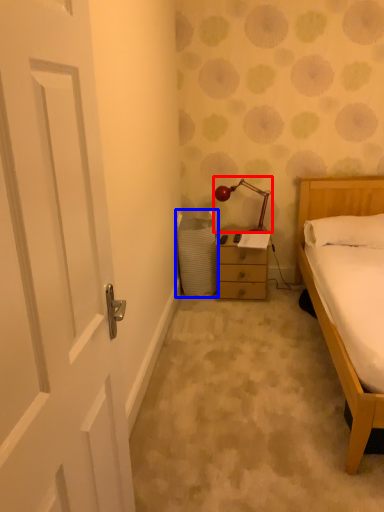
Question: Which object is closer to the camera taking this photo, lamp (highlighted by a red box) or laundry basket (highlighted by a blue box)?

Choices:
 (A) lamp
 (B) laundry basket

Answer: (B)